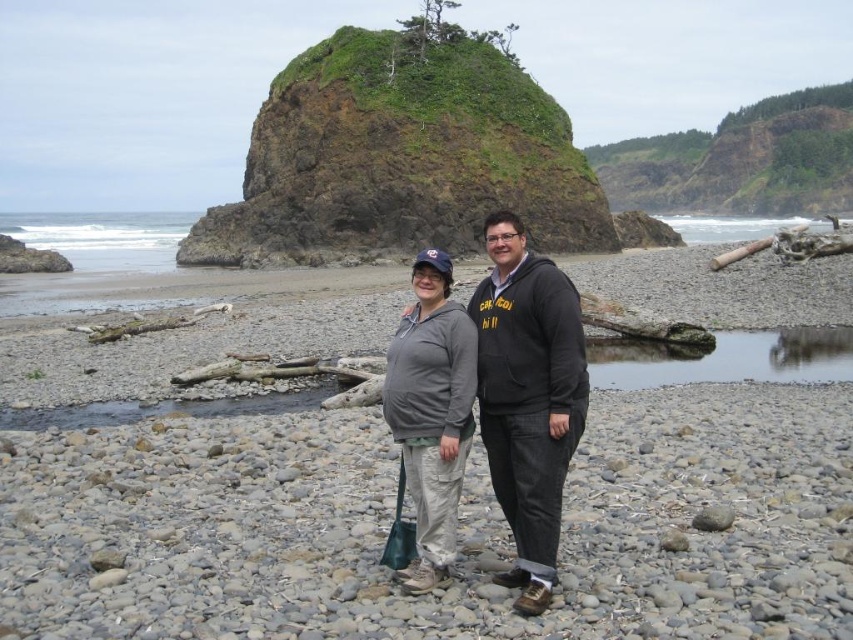
Is black fleece jacket at center above gray fleece sweatshirt at center?

Correct, black fleece jacket at center is located above gray fleece sweatshirt at center.

Does black fleece jacket at center appear on the right side of gray fleece sweatshirt at center?

Correct, you'll find black fleece jacket at center to the right of gray fleece sweatshirt at center.

Who is more forward, (544, 320) or (413, 364)?

Point (544, 320) is in front.

Where is `black fleece jacket at center`? The height and width of the screenshot is (640, 853). black fleece jacket at center is located at coordinates 527,397.

Looking at this image, is smooth pebbles at center above gray fleece sweatshirt at center?

Correct, smooth pebbles at center is located above gray fleece sweatshirt at center.

Does smooth pebbles at center come in front of gray fleece sweatshirt at center?

Yes.

Does point (33, 355) lie behind point (407, 337)?

Yes.

Locate an element on the screen. This screenshot has height=640, width=853. smooth pebbles at center is located at coordinates (457, 531).

Is smooth pebbles at center above black fleece jacket at center?

Actually, smooth pebbles at center is below black fleece jacket at center.

Is point (105, 353) farther from viewer compared to point (496, 442)?

Yes, point (105, 353) is behind point (496, 442).

Locate an element on the screen. smooth pebbles at center is located at coordinates (457, 531).